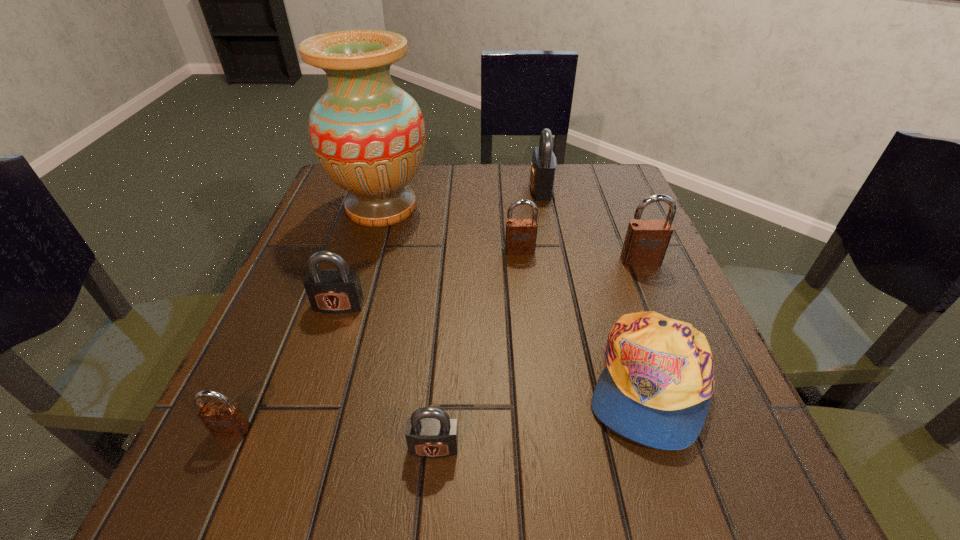
Locate an element on the screen. The height and width of the screenshot is (540, 960). the tallest object is located at coordinates coord(368,135).

The image size is (960, 540). What are the coordinates of `the second padlock from right to left` in the screenshot? It's located at (543, 166).

The height and width of the screenshot is (540, 960). I want to click on the farthest padlock, so click(x=543, y=166).

Locate an element on the screen. The image size is (960, 540). the rightmost padlock is located at coordinates (646, 241).

Find the location of a particular element. This screenshot has height=540, width=960. the second nearest brown padlock is located at coordinates (646, 241).

Locate an element on the screen. The image size is (960, 540). the farthest brown padlock is located at coordinates (520, 238).

Where is `the sixth nearest object`? The image size is (960, 540). the sixth nearest object is located at coordinates (520, 238).

This screenshot has width=960, height=540. Find the location of `the second padlock from left to right`. the second padlock from left to right is located at coordinates (334, 291).

The height and width of the screenshot is (540, 960). Find the location of `the fourth farthest padlock`. the fourth farthest padlock is located at coordinates (334, 291).

Locate an element on the screen. Image resolution: width=960 pixels, height=540 pixels. cap is located at coordinates (656, 388).